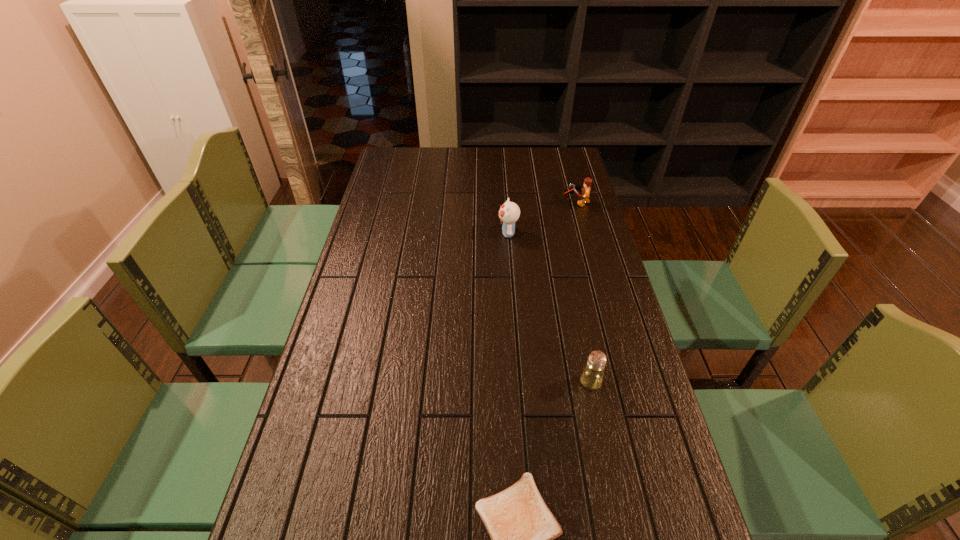
Find the location of a particular element. the third nearest object is located at coordinates (509, 212).

Identify the location of Lego. Image resolution: width=960 pixels, height=540 pixels. (585, 190).

Identify the location of the farthest object. This screenshot has width=960, height=540. (585, 190).

In order to click on the second object from right to left in this screenshot , I will do `click(592, 376)`.

Identify the location of the second nearest object. Image resolution: width=960 pixels, height=540 pixels. (592, 376).

This screenshot has height=540, width=960. What are the coordinates of `vacant space located on the front-facing side of the kitten` in the screenshot? It's located at (436, 233).

Where is `free region located 0.230m on the front-facing side of the kitten`? free region located 0.230m on the front-facing side of the kitten is located at coordinates (433, 233).

Locate an element on the screen. The image size is (960, 540). free space located on the front-facing side of the kitten is located at coordinates (461, 233).

Find the location of `free space located 0.120m holding a crossbow in the hands of the rightmost object`. free space located 0.120m holding a crossbow in the hands of the rightmost object is located at coordinates (533, 203).

Find the location of `free point located 0.060m holding a crossbow in the hands of the rightmost object`. free point located 0.060m holding a crossbow in the hands of the rightmost object is located at coordinates (548, 203).